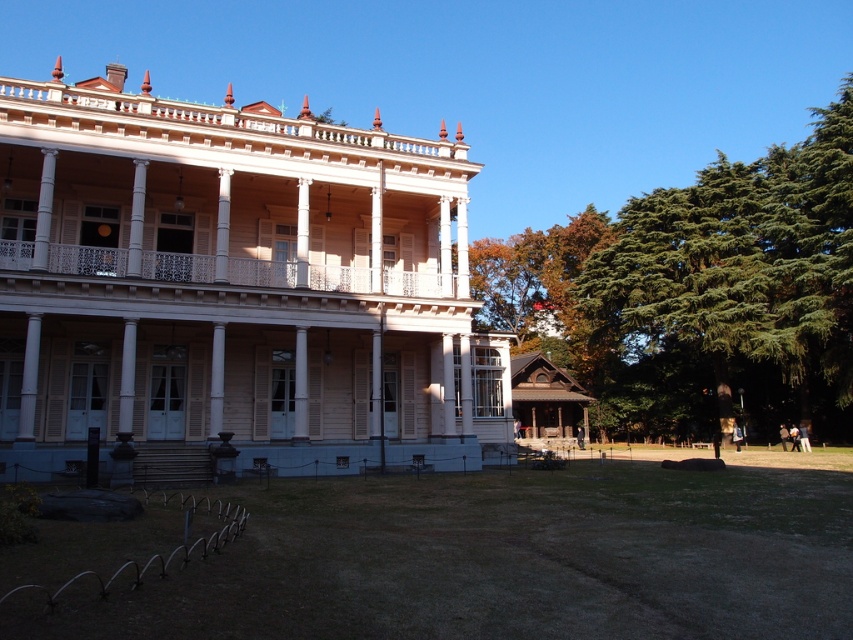
You are standing on the green grass at lower center and want to reach the white painted wood porch at center. Which direction should you move to get there?

You should move upward to reach the white painted wood porch at center because the green grass at lower center is located below it.

You are standing in front of the grand building and want to walk from the light beige wood mansion at center to the white painted wood porch at center. In which direction should you move relative to the mansion?

You should move to the right relative to the light beige wood mansion at center because the white painted wood porch at center is located to the right of it.

You are a gardener who needs to mow the lawn. You see the green grass at lower center and the white painted wood porch at center. Which area requires immediate attention based on their current state?

The green grass at lower center requires immediate attention because it is much taller than the white painted wood porch at center, indicating it needs mowing.